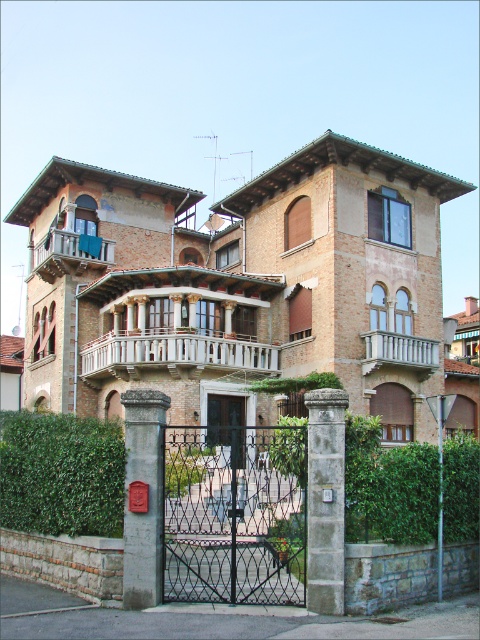
Question: Is green leafy hedge at lower center below white wooden balcony at center?

Choices:
 (A) yes
 (B) no

Answer: (A)

Question: Which object appears farthest from the camera in this image?

Choices:
 (A) wooden balcony at upper left
 (B) smooth concrete post at center
 (C) white wooden balcony at center
 (D) green leafy hedge at lower left

Answer: (A)

Question: Estimate the real-world distances between objects in this image. Which object is closer to the smooth concrete post at center?

Choices:
 (A) green leafy hedge at lower center
 (B) white wooden balcony at center
 (C) black wrought iron gate at center

Answer: (C)

Question: Is stone gate post at center thinner than white wooden balcony at upper center?

Choices:
 (A) no
 (B) yes

Answer: (A)

Question: Where is smooth concrete post at center located in relation to white wooden balcony at center in the image?

Choices:
 (A) above
 (B) below

Answer: (B)

Question: Which point is closer to the camera?

Choices:
 (A) (100, 243)
 (B) (303, 467)
 (C) (422, 358)

Answer: (B)